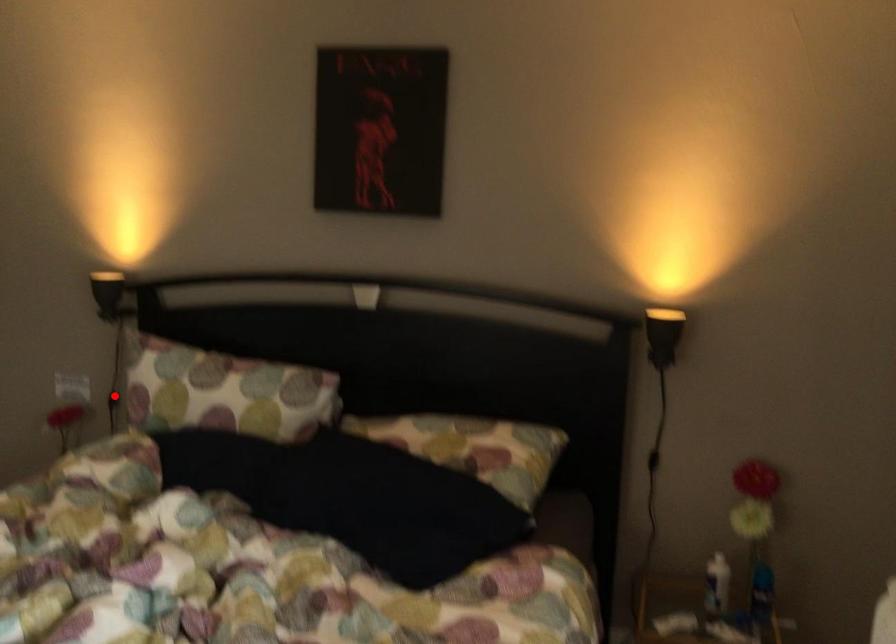
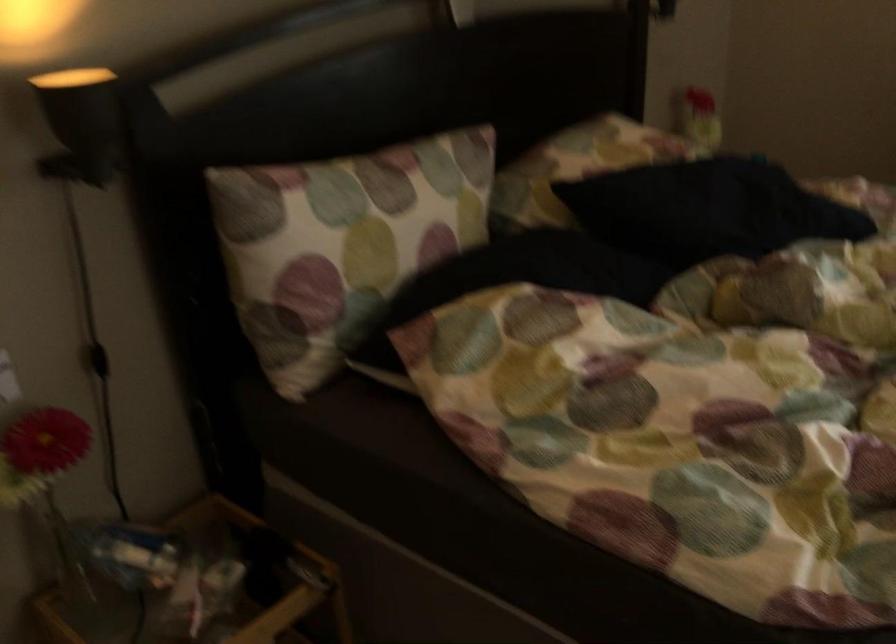
Question: I am providing you with two images of the same scene from different viewpoints. Given a red point in image1, look at the same physical point in image2. Is it:

Choices:
 (A) Closer to the viewpoint
 (B) Farther from the viewpoint

Answer: (A)